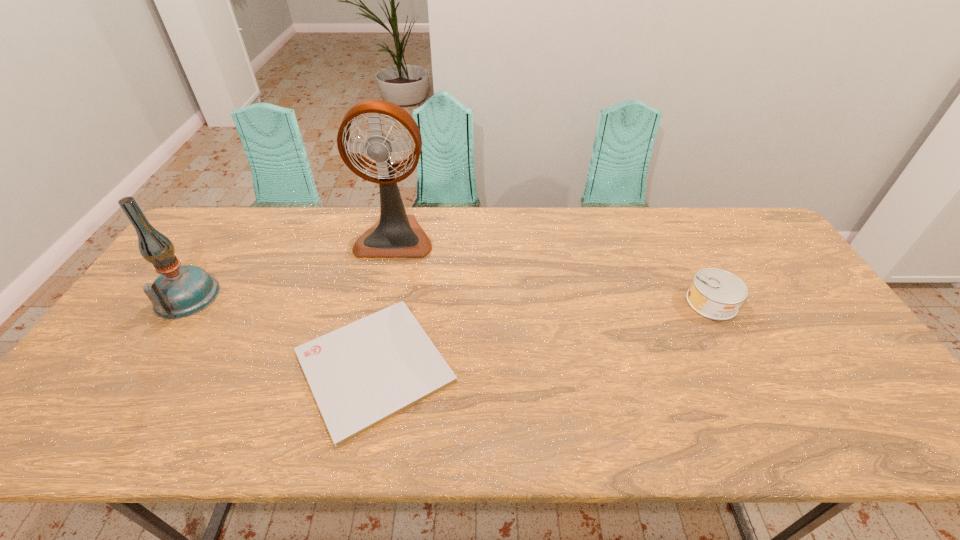
Where is `free space between the second shortest object and the shortest object`? This screenshot has width=960, height=540. free space between the second shortest object and the shortest object is located at coordinates (543, 334).

Where is `vacant area that lies between the shortest object and the tallest object`? vacant area that lies between the shortest object and the tallest object is located at coordinates (385, 301).

I want to click on unoccupied area between the shortest object and the leftmost object, so click(280, 332).

You are a GUI agent. You are given a task and a screenshot of the screen. Output one action in this format:
    pyautogui.click(x=<x>, y=<y>)
    Task: Click on the vacant area that lies between the clipboard and the tallest object
    The height and width of the screenshot is (540, 960).
    Given the screenshot: What is the action you would take?
    tap(385, 301)

At what (x,y) coordinates should I click in order to perform the action: click on free space between the shortest object and the second tallest object. Please return your answer as a coordinate pair (x, y). The width and height of the screenshot is (960, 540). Looking at the image, I should click on (280, 332).

Image resolution: width=960 pixels, height=540 pixels. I want to click on free space that is in between the can and the shortest object, so click(543, 334).

Find the location of a particular element. unoccupied position between the can and the third shortest object is located at coordinates (449, 300).

Point out which object is positioned as the nearest to the clipboard. Please provide its 2D coordinates. Your answer should be formatted as a tuple, i.e. [(x, y)], where the tuple contains the x and y coordinates of a point satisfying the conditions above.

[(396, 234)]

Locate an element on the screen. This screenshot has height=540, width=960. the second closest object to the tallest object is located at coordinates (180, 291).

Where is `free point that satisfies the following two spatial constraints: 1. on the front-facing side of the tallest object; 2. on the right side of the can`? The image size is (960, 540). free point that satisfies the following two spatial constraints: 1. on the front-facing side of the tallest object; 2. on the right side of the can is located at coordinates (380, 302).